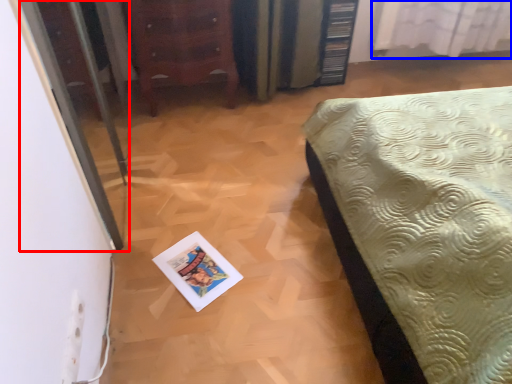
Question: Which point is closer to the camera, screen door (highlighted by a red box) or curtain (highlighted by a blue box)?

Choices:
 (A) screen door
 (B) curtain

Answer: (A)